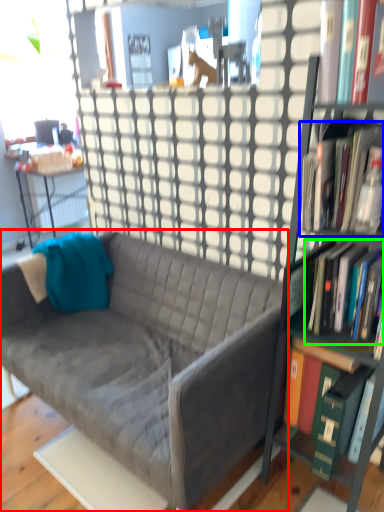
Question: Considering the real-world distances, which object is farthest from studio couch (highlighted by a red box)? book (highlighted by a blue box) or book (highlighted by a green box)?

Choices:
 (A) book
 (B) book

Answer: (A)